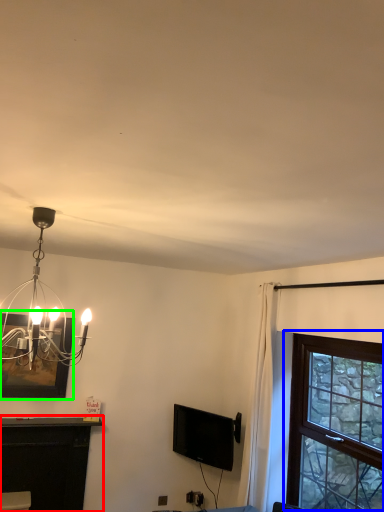
Question: Which object is positioned farthest from table (highlighted by a red box)? Select from window (highlighted by a blue box) and picture frame (highlighted by a green box).

Choices:
 (A) window
 (B) picture frame

Answer: (A)